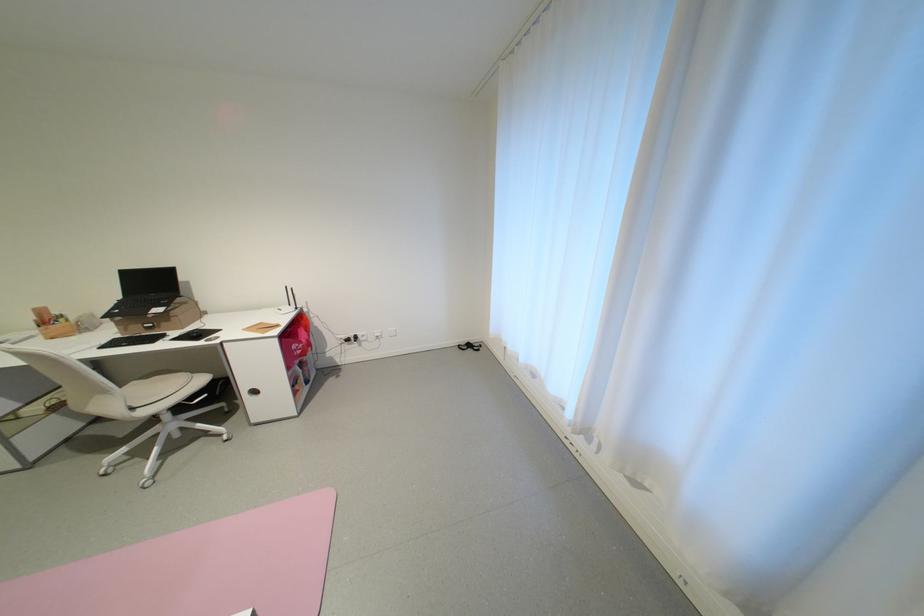
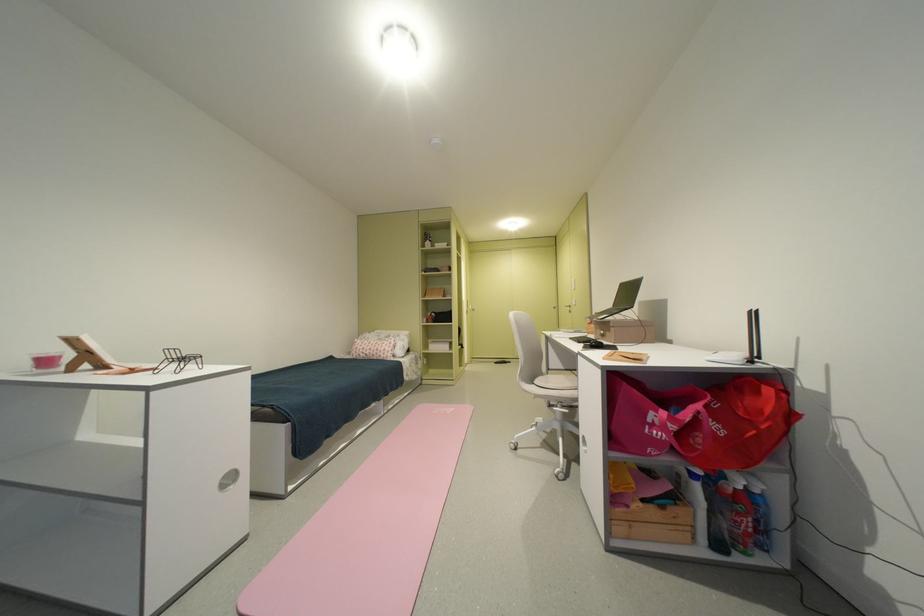
In the second image, find the point that corresponds to point 178,322 in the first image.

(618, 331)